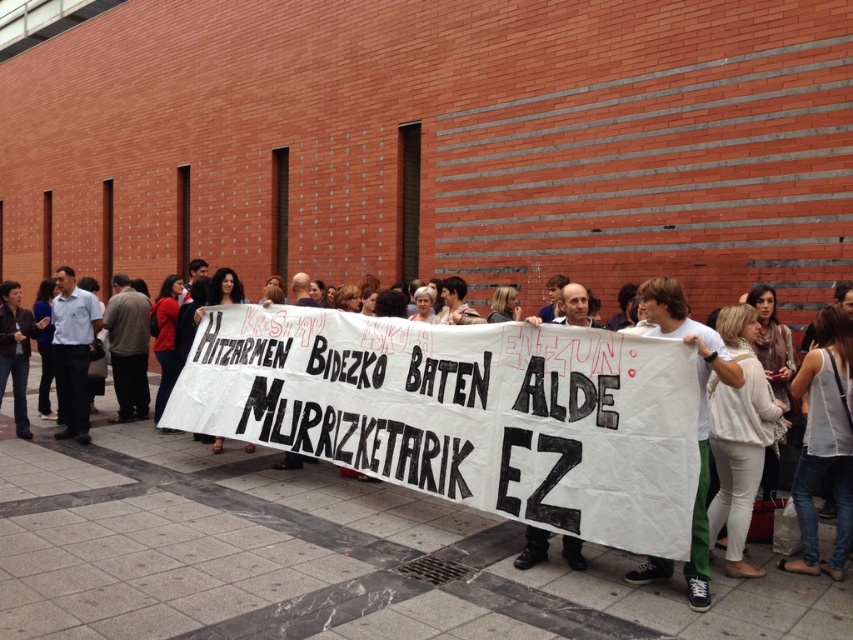
Between white paper banner at center and white fabric banner at center, which one appears on the right side from the viewer's perspective?

white fabric banner at center

Can you confirm if white paper banner at center is positioned below white fabric banner at center?

Actually, white paper banner at center is above white fabric banner at center.

Is point (497, 388) farther from camera compared to point (686, 312)?

That is True.

Where is `white paper banner at center`? The height and width of the screenshot is (640, 853). white paper banner at center is located at coordinates (378, 477).